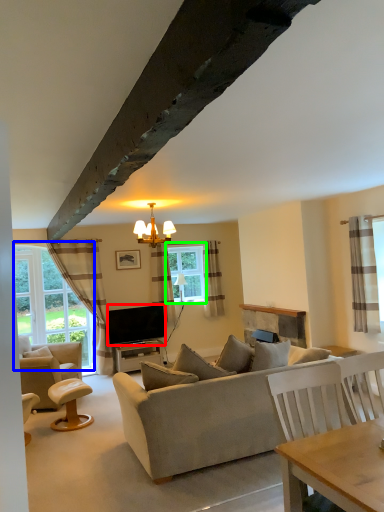
Question: Based on their relative distances, which object is nearer to television (highlighted by a red box)? Choose from bay window (highlighted by a blue box) and window (highlighted by a green box).

Choices:
 (A) bay window
 (B) window

Answer: (B)